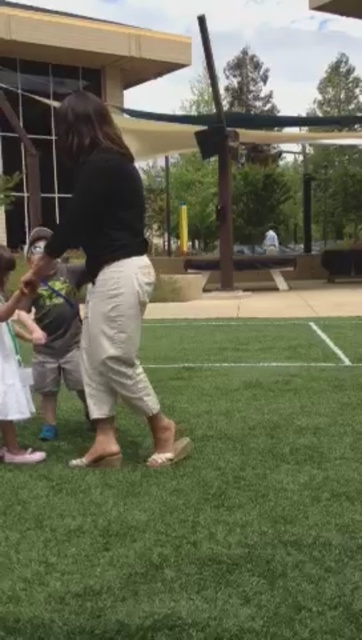
Does matte black shirt at center appear on the left side of white fabric bag at lower left?

In fact, matte black shirt at center is to the right of white fabric bag at lower left.

Does point (173, 460) come in front of point (27, 461)?

That is True.

Does point (97, 97) lie in front of point (18, 358)?

No, it is not.

At what (x,y) coordinates should I click in order to perform the action: click on matte black shirt at center. Please return your answer as a coordinate pair (x, y). Image resolution: width=362 pixels, height=640 pixels. Looking at the image, I should click on (107, 276).

Is point (191, 564) closer to camera compared to point (107, 353)?

Yes, point (191, 564) is in front of point (107, 353).

Image resolution: width=362 pixels, height=640 pixels. Find the location of `green grass at center`. green grass at center is located at coordinates (201, 500).

Who is more forward, (66, 484) or (127, 360)?

Point (66, 484) is in front.

Locate an element on the screen. green grass at center is located at coordinates (201, 500).

Which is below, matte black shirt at center or green fabric shorts at center?

green fabric shorts at center is lower down.

Which is in front, point (108, 422) or point (62, 380)?

Point (108, 422)

Measure the distance between matte black shirt at center and camera.

The distance of matte black shirt at center from camera is 8.73 feet.

Image resolution: width=362 pixels, height=640 pixels. Find the location of `matte black shirt at center`. matte black shirt at center is located at coordinates (107, 276).